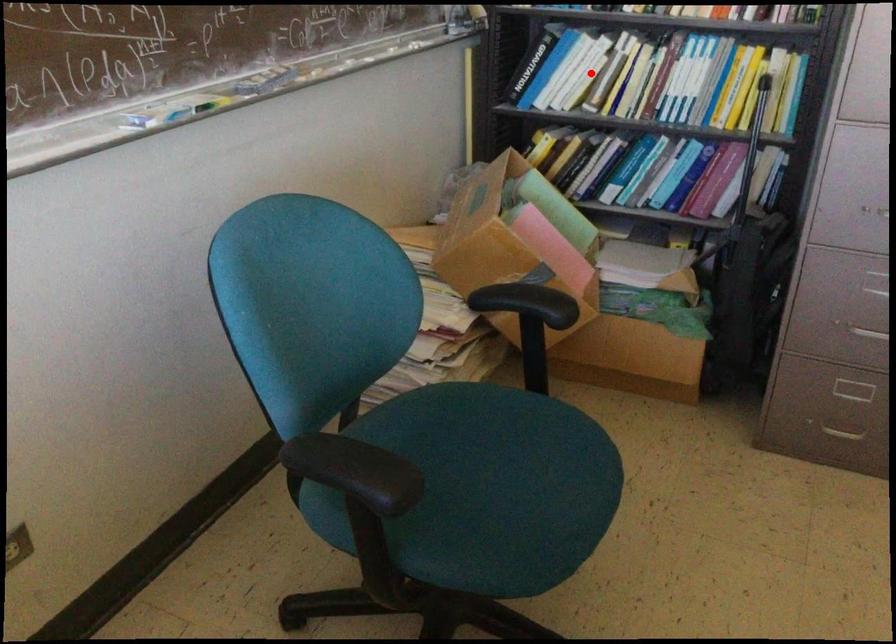
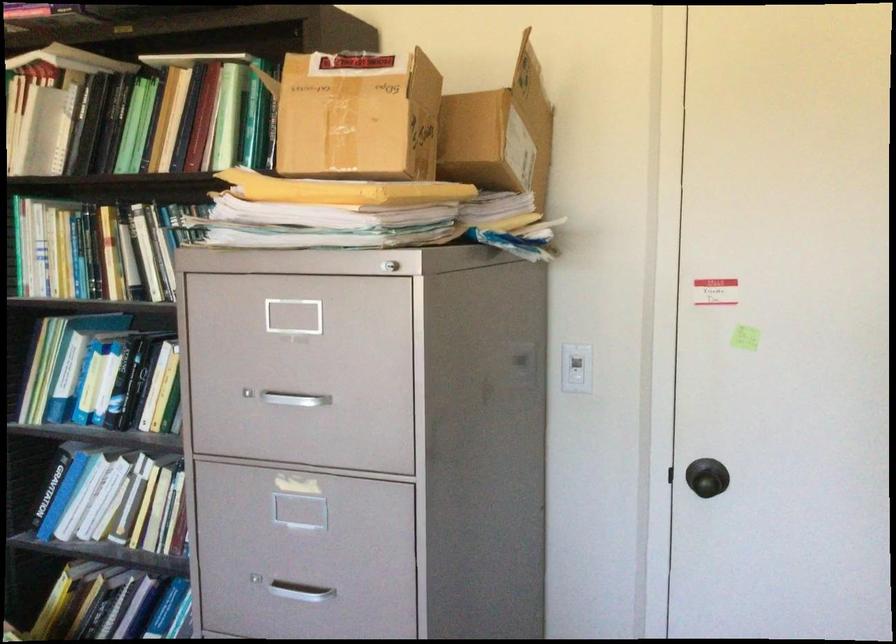
Question: A red point is marked in image1. In image2, is the corresponding 3D point closer to the camera or farther? Reply with the corresponding letter.

Choices:
 (A) The corresponding 3D point is closer.
 (B) The corresponding 3D point is farther.

Answer: (A)